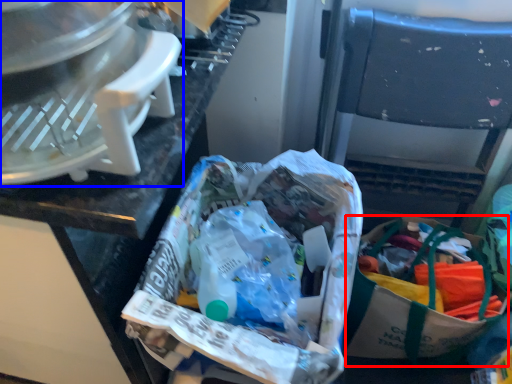
Question: Which object appears closest to the camera in this image, shopping bag (highlighted by a red box) or kitchen appliance (highlighted by a blue box)?

Choices:
 (A) shopping bag
 (B) kitchen appliance

Answer: (B)